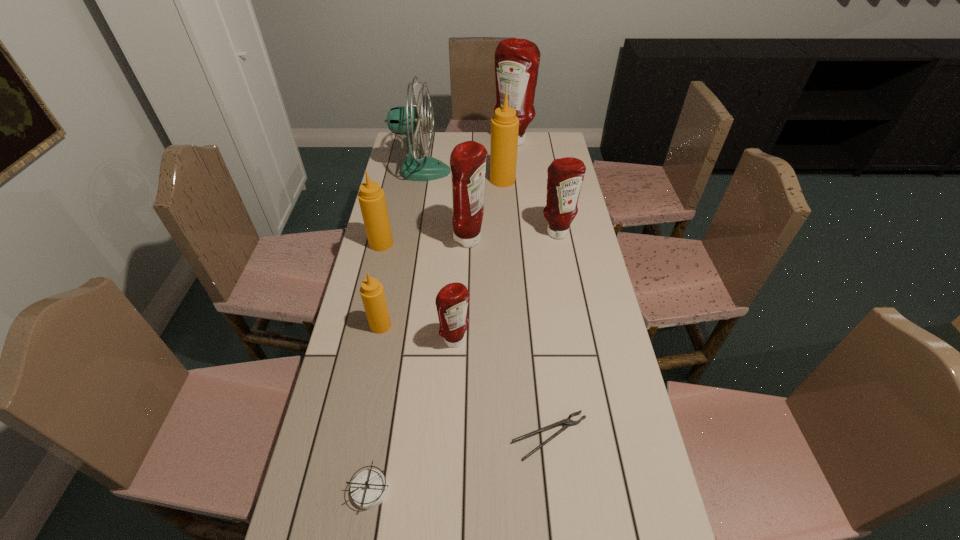
Find the location of a particular element. The width and height of the screenshot is (960, 540). vacant area that lies between the nearest tan condiment and the third smallest red condiment is located at coordinates (425, 283).

Find the location of a particular element. The height and width of the screenshot is (540, 960). empty location between the third smallest red condiment and the second smallest tan condiment is located at coordinates (425, 242).

Find the location of a particular element. The height and width of the screenshot is (540, 960). vacant area that lies between the smallest red condiment and the second smallest red condiment is located at coordinates (507, 287).

Locate an element on the screen. object that ranks as the second closest to the biggest red condiment is located at coordinates (504, 125).

Select which object appears as the fourth closest to the fan. Please provide its 2D coordinates. Your answer should be formatted as a tuple, i.e. [(x, y)], where the tuple contains the x and y coordinates of a point satisfying the conditions above.

[(371, 197)]

Select which condiment is the third closest to the farthest object. Please provide its 2D coordinates. Your answer should be formatted as a tuple, i.e. [(x, y)], where the tuple contains the x and y coordinates of a point satisfying the conditions above.

[(468, 159)]

Locate which condiment ranks third in proximity to the smallest red condiment. Please provide its 2D coordinates. Your answer should be formatted as a tuple, i.e. [(x, y)], where the tuple contains the x and y coordinates of a point satisfying the conditions above.

[(371, 197)]

Locate which red condiment ranks in proximity to the nearest red condiment. Please provide its 2D coordinates. Your answer should be formatted as a tuple, i.e. [(x, y)], where the tuple contains the x and y coordinates of a point satisfying the conditions above.

[(468, 159)]

Identify which red condiment is the nearest to the teal fan. Please provide its 2D coordinates. Your answer should be formatted as a tuple, i.e. [(x, y)], where the tuple contains the x and y coordinates of a point satisfying the conditions above.

[(517, 61)]

Select which tan condiment appears as the closest to the second nearest tan condiment. Please provide its 2D coordinates. Your answer should be formatted as a tuple, i.e. [(x, y)], where the tuple contains the x and y coordinates of a point satisfying the conditions above.

[(372, 293)]